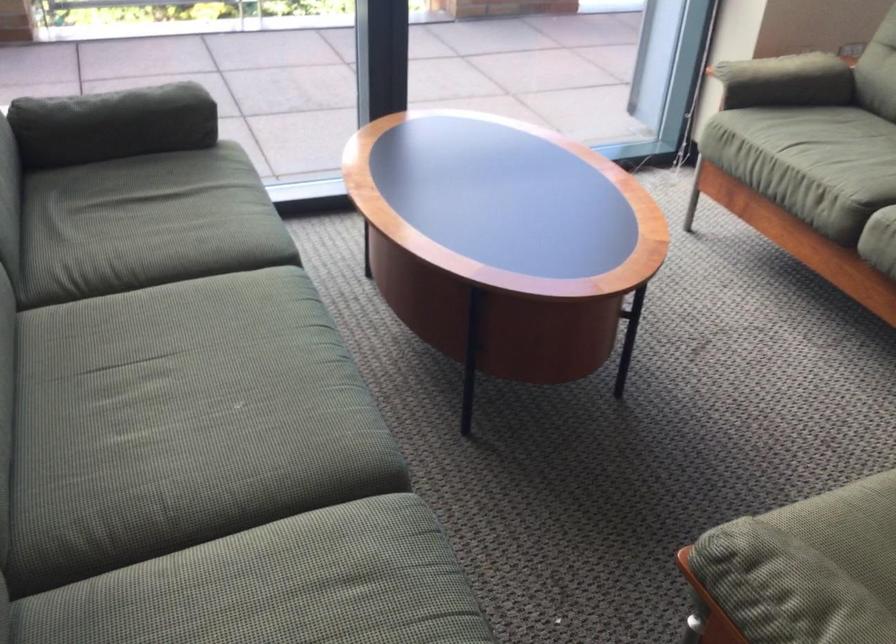
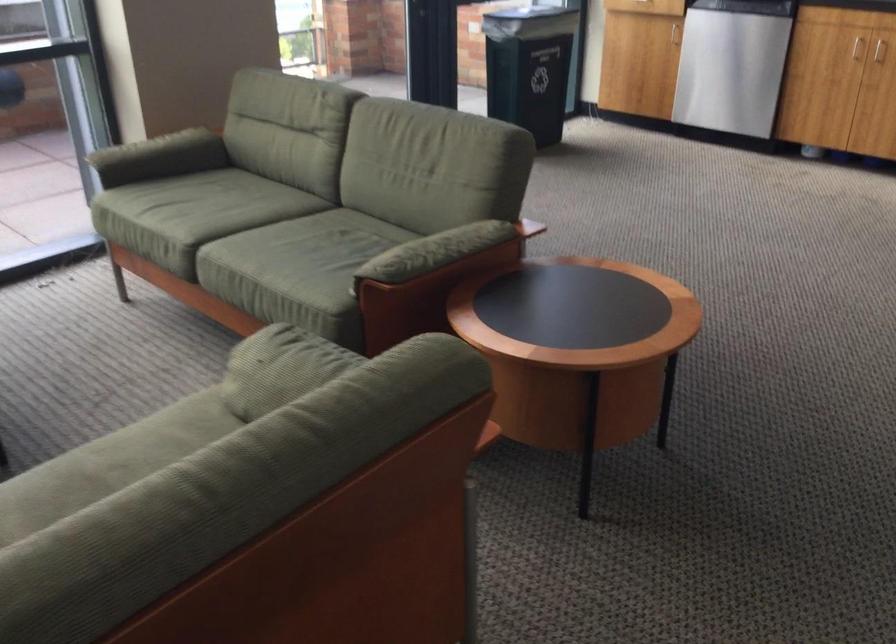
Question: The camera is either moving clockwise (left) or counter-clockwise (right) around the object. The first image is from the beginning of the video and the second image is from the end. Is the camera moving left or right when shooting the video?

Choices:
 (A) Left
 (B) Right

Answer: (A)